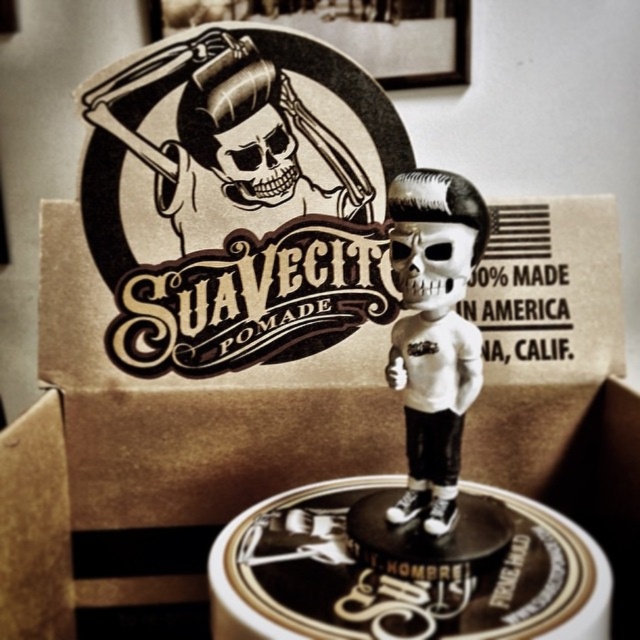
Question: From the image, what is the correct spatial relationship of brown cardboard box at upper center in relation to black matte skull at center?

Choices:
 (A) left
 (B) right

Answer: (B)

Question: Which is farther from the matte black skull at center?

Choices:
 (A) black wood skull at center
 (B) brown cardboard box at upper center

Answer: (B)

Question: Is black wood skull at center wider than white matte skull at center?

Choices:
 (A) yes
 (B) no

Answer: (A)

Question: Can you confirm if brown cardboard box at upper center is positioned to the right of white matte skull at center?

Choices:
 (A) no
 (B) yes

Answer: (A)

Question: Among these points, which one is nearest to the camera?

Choices:
 (A) (365, 216)
 (B) (273, 179)
 (C) (454, 300)

Answer: (C)

Question: Which point is farther to the camera?

Choices:
 (A) black wood skull at center
 (B) black matte skull at center
 (C) brown cardboard box at upper center
 (D) matte black skull at center

Answer: (B)